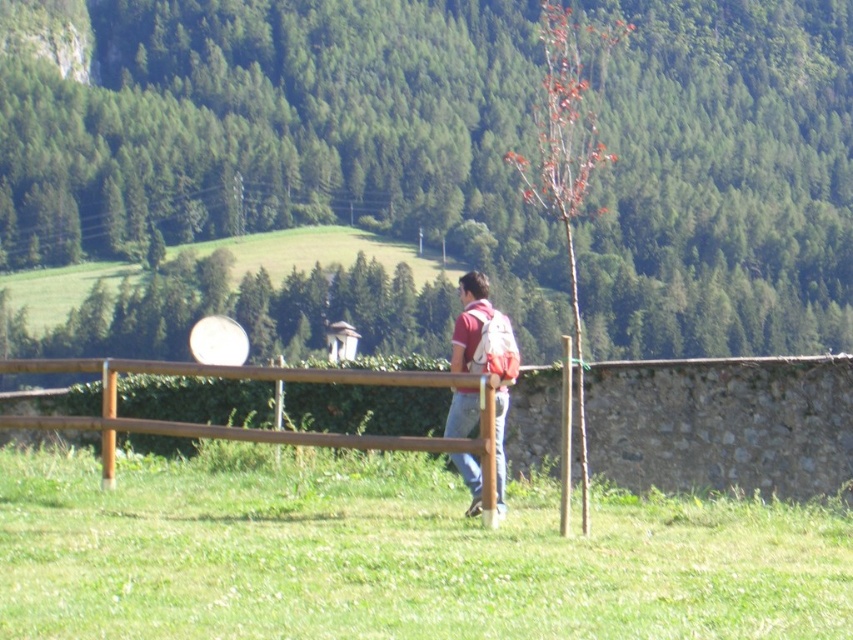
What do you see at coordinates (277, 132) in the screenshot? The width and height of the screenshot is (853, 640). I see `green leafy tree at upper center` at bounding box center [277, 132].

Is point (518, 189) positioned in front of point (556, 182)?

No, (518, 189) is further to viewer.

Image resolution: width=853 pixels, height=640 pixels. I want to click on green leafy tree at upper center, so click(x=277, y=132).

Does green leafy tree at upper center have a lesser width compared to brown wooden fence at center?

In fact, green leafy tree at upper center might be wider than brown wooden fence at center.

Does green leafy tree at upper center appear under brown wooden fence at center?

No.

Image resolution: width=853 pixels, height=640 pixels. I want to click on green leafy tree at upper center, so click(x=277, y=132).

Who is more distant from viewer, (42,86) or (492,326)?

The point (42,86) is more distant.

From the picture: Can you confirm if green leafy tree at upper center is positioned to the right of reddish-brown backpack at center?

Yes, green leafy tree at upper center is to the right of reddish-brown backpack at center.

The width and height of the screenshot is (853, 640). What do you see at coordinates (277, 132) in the screenshot? I see `green leafy tree at upper center` at bounding box center [277, 132].

I want to click on green leafy tree at upper center, so click(277, 132).